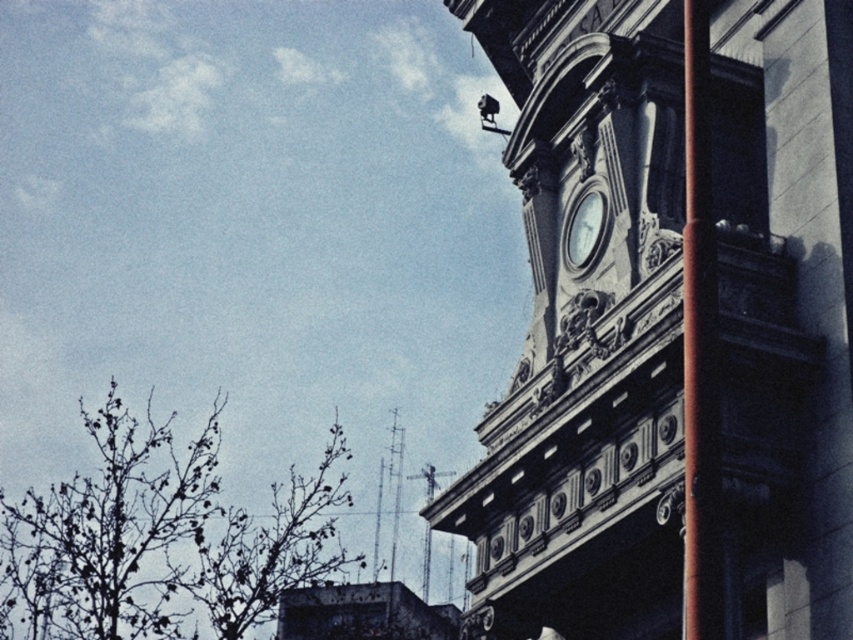
Question: Where is polished stone clock at upper center located in relation to bare branches at lower left in the image?

Choices:
 (A) left
 (B) right

Answer: (B)

Question: Which point is farther to the camera?

Choices:
 (A) (225, 509)
 (B) (595, 214)
 (C) (726, 577)

Answer: (A)

Question: Which point is closer to the camera?

Choices:
 (A) (688, 356)
 (B) (340, 506)

Answer: (A)

Question: Can you confirm if polished stone clock at upper center is positioned to the right of white glossy clock at upper center?

Choices:
 (A) no
 (B) yes

Answer: (B)

Question: Is bare branches at lower left positioned at the back of white glossy clock at upper center?

Choices:
 (A) no
 (B) yes

Answer: (B)

Question: Which object is closer to the camera taking this photo?

Choices:
 (A) polished stone clock at upper center
 (B) white glossy clock at upper center
 (C) smooth brown pole at right
 (D) bare branches at lower left

Answer: (C)